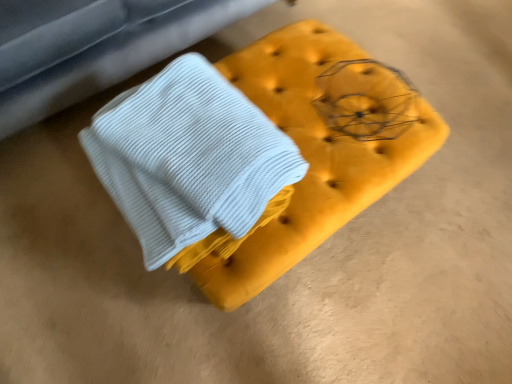
Where is `spots to the right of velvet yellow ottoman at center, the 2th furniture from the top`? The image size is (512, 384). spots to the right of velvet yellow ottoman at center, the 2th furniture from the top is located at coordinates (445, 220).